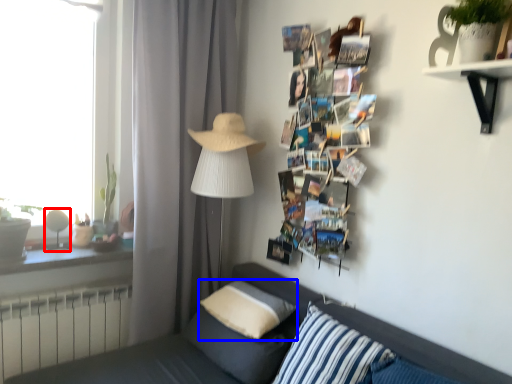
Question: Among these objects, which one is farthest to the camera, table lamp (highlighted by a red box) or pillow (highlighted by a blue box)?

Choices:
 (A) table lamp
 (B) pillow

Answer: (A)